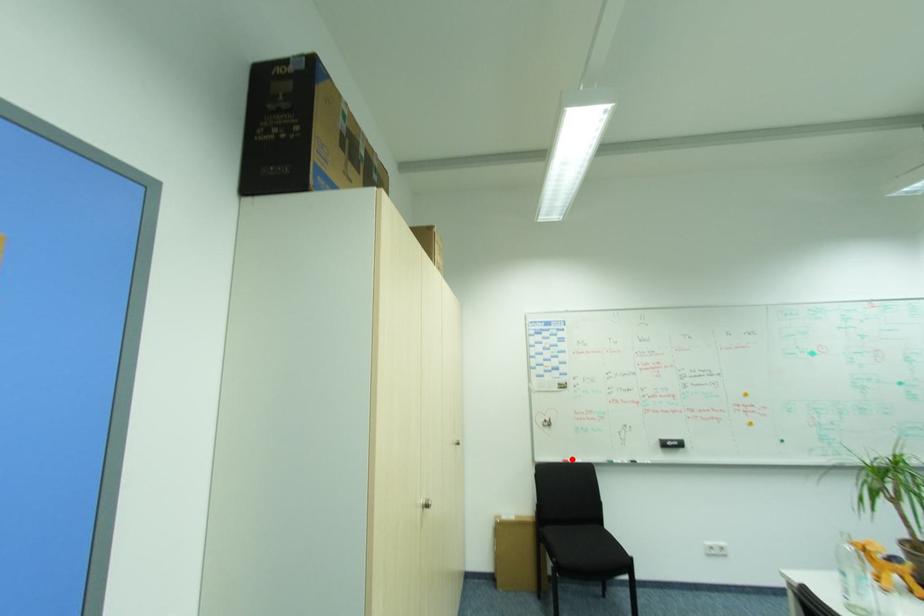
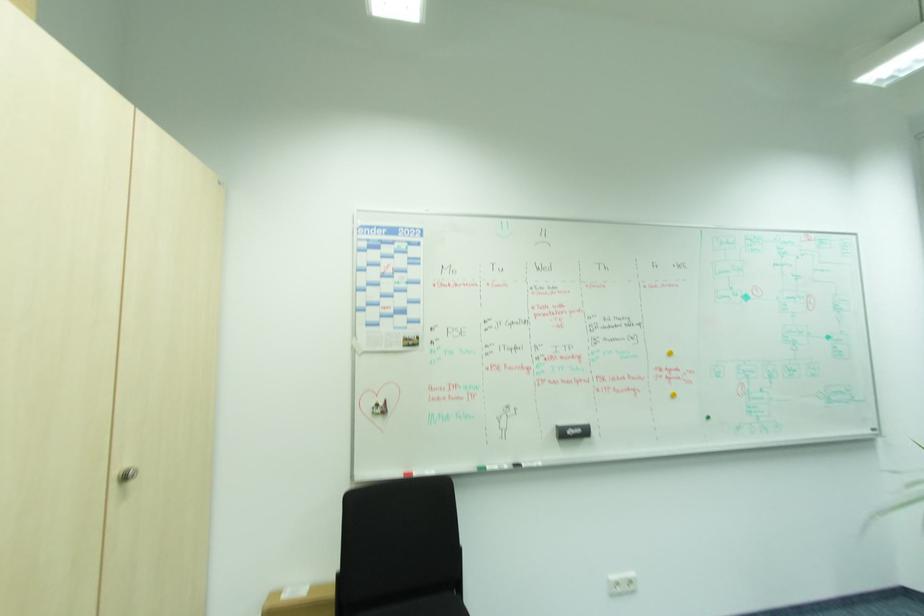
Question: I am providing you with two images of the same scene from different viewpoints. In image1, a red point is highlighted. Considering the same 3D point in image2, which of the following is correct?

Choices:
 (A) It is closer
 (B) It is farther

Answer: (A)